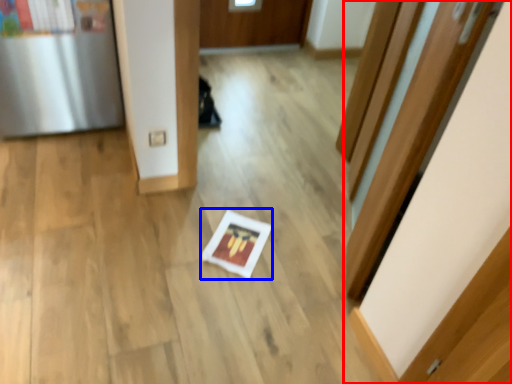
Question: Which object appears closest to the camera in this image, door (highlighted by a red box) or copy (highlighted by a blue box)?

Choices:
 (A) door
 (B) copy

Answer: (A)